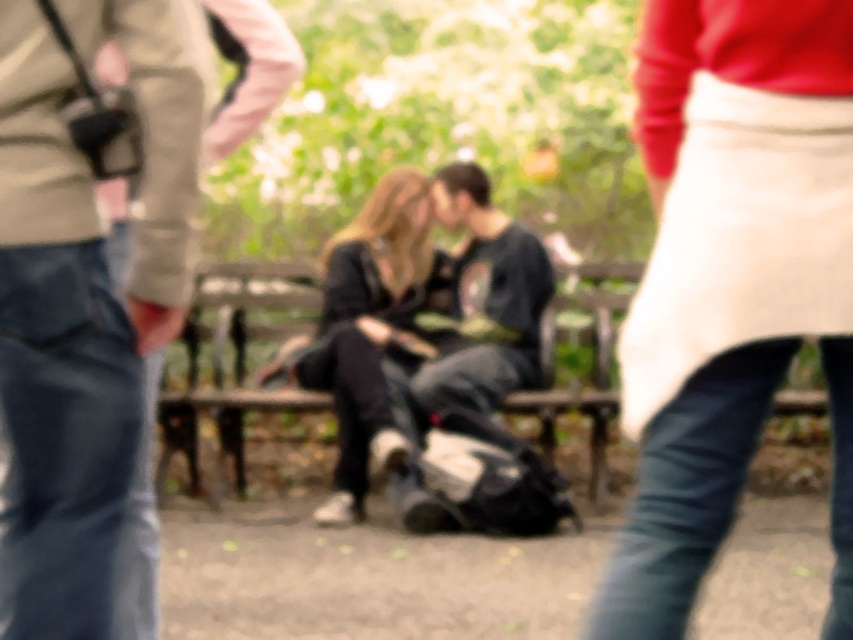
Question: Estimate the real-world distances between objects in this image. Which object is farther from the black matte shirt at center?

Choices:
 (A) black matte jacket at center
 (B) matte black backpack at center
 (C) wooden park bench at center

Answer: (B)

Question: Is wooden park bench at center bigger than black matte jacket at center?

Choices:
 (A) no
 (B) yes

Answer: (A)

Question: Among these objects, which one is nearest to the camera?

Choices:
 (A) matte black backpack at center
 (B) black matte jacket at center

Answer: (A)

Question: Which point is closer to the camera?

Choices:
 (A) (373, 346)
 (B) (172, 120)
 (C) (466, 320)

Answer: (B)

Question: Is wooden park bench at center smaller than black matte shirt at center?

Choices:
 (A) no
 (B) yes

Answer: (A)

Question: Is wooden park bench at center further to camera compared to black matte shirt at center?

Choices:
 (A) yes
 (B) no

Answer: (A)